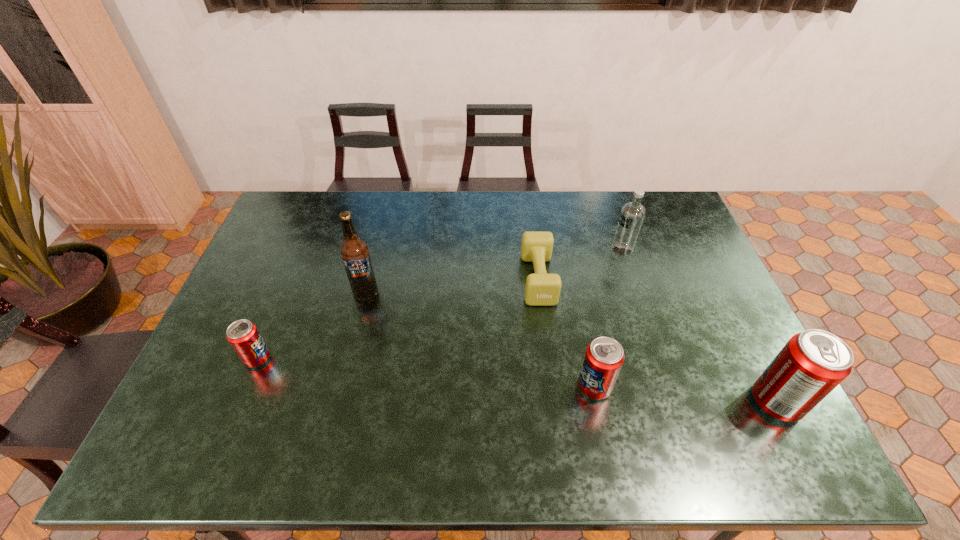
At what (x,y) coordinates should I click in order to perform the action: click on free space for an extra pop_(soda) to achieve even spacing. Please return your answer as a coordinate pair (x, y). Looking at the image, I should click on (421, 372).